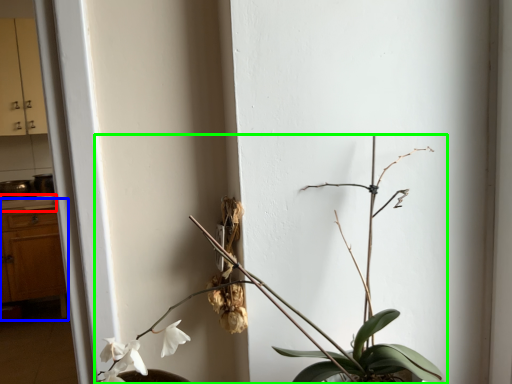
Question: Based on their relative distances, which object is nearer to counter top (highlighted by a red box)? Choose from dresser (highlighted by a blue box) and houseplant (highlighted by a green box).

Choices:
 (A) dresser
 (B) houseplant

Answer: (A)